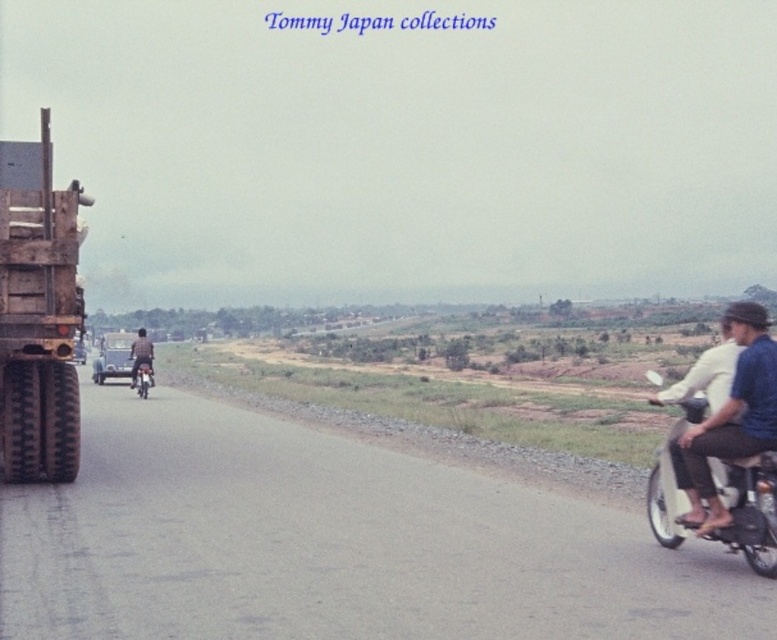
Question: Which object is closer to the camera taking this photo?

Choices:
 (A) dark blue shirt at center-left
 (B) blue denim shorts at right
 (C) metallic silver motorcycle at center-left

Answer: (B)

Question: Which object is closer to the camera taking this photo?

Choices:
 (A) blue denim shorts at right
 (B) dark blue shirt at center-left
 (C) metallic silver motorcycle at center-left
 (D) rusty metal truck at left

Answer: (A)

Question: Which of the following is the farthest from the observer?

Choices:
 (A) (140, 396)
 (B) (720, 477)
 (C) (720, 413)
 (D) (150, 371)

Answer: (A)

Question: Does blue denim shorts at right have a larger size compared to metallic silver motorcycle at center-left?

Choices:
 (A) no
 (B) yes

Answer: (B)

Question: In this image, where is blue denim shorts at right located relative to metallic silver motorcycle at center-left?

Choices:
 (A) below
 (B) above

Answer: (B)

Question: Can you confirm if rusty metal truck at left is thinner than metallic silver scooter at right?

Choices:
 (A) no
 (B) yes

Answer: (A)